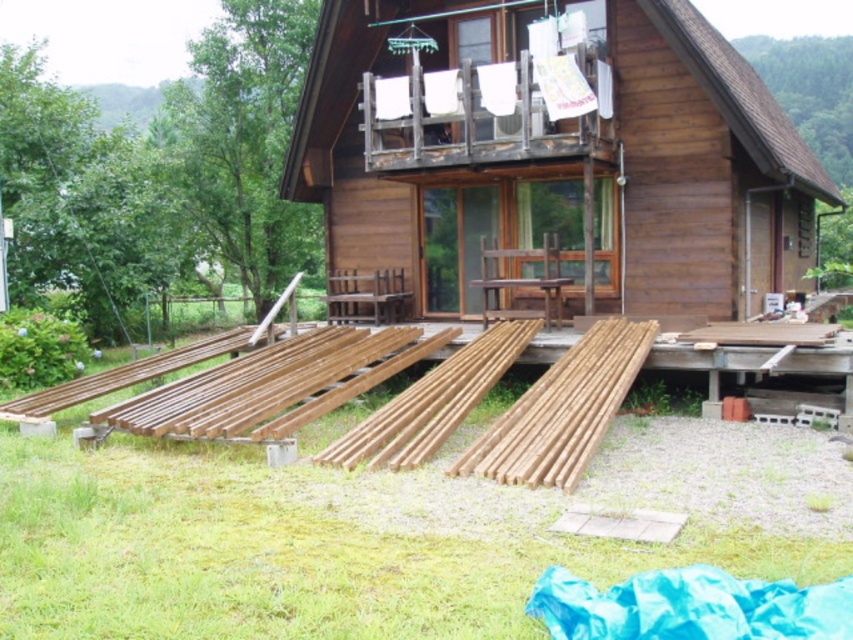
Question: Considering the relative positions of wooden cabin at center and natural wood planks at lower center in the image provided, where is wooden cabin at center located with respect to natural wood planks at lower center?

Choices:
 (A) right
 (B) left

Answer: (A)

Question: Can you confirm if wooden cabin at center is bigger than natural wood planks at lower center?

Choices:
 (A) yes
 (B) no

Answer: (B)

Question: Is wooden cabin at center positioned before natural wood planks at lower center?

Choices:
 (A) no
 (B) yes

Answer: (A)

Question: Which object is closer to the camera taking this photo?

Choices:
 (A) wooden cabin at center
 (B) natural wood planks at lower center

Answer: (B)

Question: Which object is farther from the camera taking this photo?

Choices:
 (A) wooden cabin at center
 (B) natural wood planks at lower center

Answer: (A)